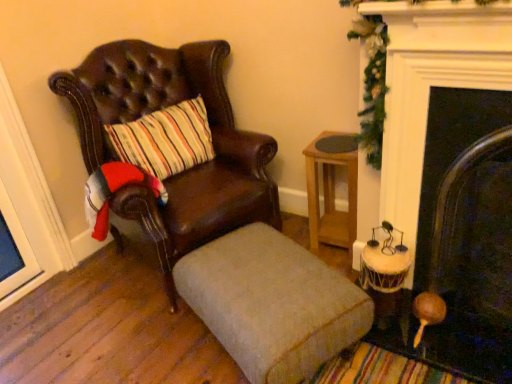
Question: Considering the relative sizes of beige fabric ottoman at center and leather chair at left in the image provided, is beige fabric ottoman at center bigger than leather chair at left?

Choices:
 (A) yes
 (B) no

Answer: (B)

Question: Does beige fabric ottoman at center have a smaller size compared to leather chair at left?

Choices:
 (A) yes
 (B) no

Answer: (A)

Question: From the image's perspective, is beige fabric ottoman at center on top of leather chair at left?

Choices:
 (A) no
 (B) yes

Answer: (A)

Question: From a real-world perspective, is beige fabric ottoman at center physically above leather chair at left?

Choices:
 (A) yes
 (B) no

Answer: (B)

Question: Is beige fabric ottoman at center taller than leather chair at left?

Choices:
 (A) no
 (B) yes

Answer: (A)

Question: Can you see beige fabric ottoman at center touching leather chair at left?

Choices:
 (A) no
 (B) yes

Answer: (A)

Question: Is light brown wooden table at center-right to the left of beige fabric ottoman at center from the viewer's perspective?

Choices:
 (A) yes
 (B) no

Answer: (B)

Question: Would you say light brown wooden table at center-right contains beige fabric ottoman at center?

Choices:
 (A) no
 (B) yes

Answer: (A)

Question: Is the depth of light brown wooden table at center-right less than that of beige fabric ottoman at center?

Choices:
 (A) yes
 (B) no

Answer: (B)

Question: Could you tell me if light brown wooden table at center-right is turned towards beige fabric ottoman at center?

Choices:
 (A) yes
 (B) no

Answer: (A)

Question: Considering the relative positions of light brown wooden table at center-right and beige fabric ottoman at center in the image provided, is light brown wooden table at center-right behind beige fabric ottoman at center?

Choices:
 (A) yes
 (B) no

Answer: (A)

Question: Does light brown wooden table at center-right have a lesser width compared to beige fabric ottoman at center?

Choices:
 (A) yes
 (B) no

Answer: (A)

Question: Considering the relative sizes of beige fabric ottoman at center and green garland at upper right in the image provided, is beige fabric ottoman at center wider than green garland at upper right?

Choices:
 (A) no
 (B) yes

Answer: (B)